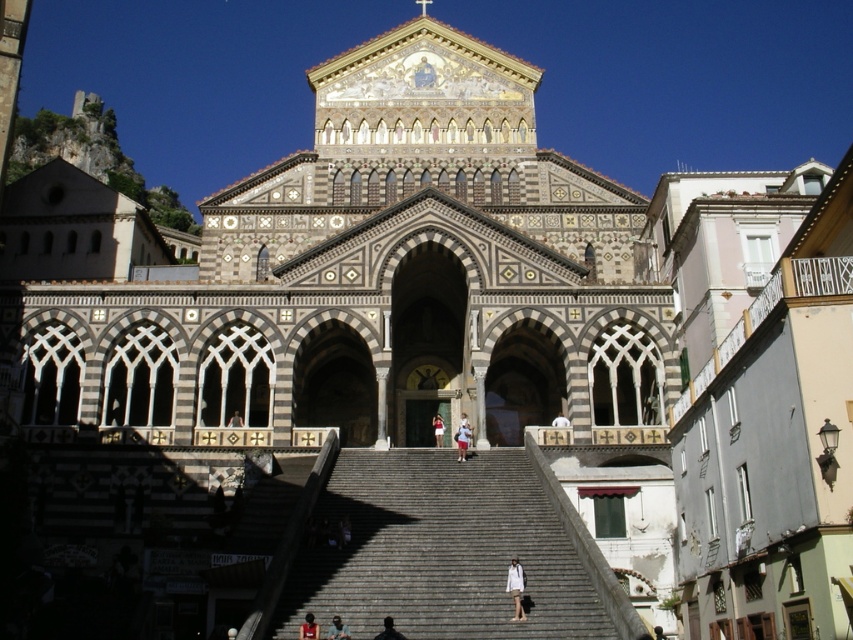
You are a photographer planning to take a photo of the Amalfi Cathedral. You notice two shirts hanging on a rack nearby, a light beige cotton shirt at center and a white cotton shirt at center. If you want to choose the shirt that is narrower to wear for the photo, which one should you pick?

The light beige cotton shirt at center has a lesser width compared to the white cotton shirt at center, so you should pick the light beige cotton shirt at center for the photo.

You are standing at the base of the Amalfi Cathedral and notice a tourist wearing a white cotton shirt at center. If you want to take a photo that includes both the tourist and the cathedral in the frame, would the tourist be in the foreground or background?

The tourist wearing the white cotton shirt at center is 59.14 meters away from the camera, which places them in the background since they are far from the camera, allowing both the tourist and the cathedral to be captured in the same frame.

From the picture: You are standing in front of the Amalfi Cathedral and see the gray stone stairs at center and the light beige cotton shirt at center. Which object is taller?

The gray stone stairs at center are much taller than the light beige cotton shirt at center.